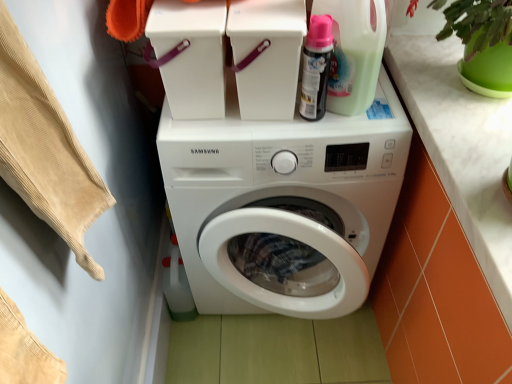
What do you see at coordinates (316, 67) in the screenshot? I see `matte black spray can at upper right, which is counted as the second cleaning product, starting from the right` at bounding box center [316, 67].

Describe the element at coordinates (284, 202) in the screenshot. I see `white glossy washing machine at center` at that location.

The height and width of the screenshot is (384, 512). What do you see at coordinates (461, 148) in the screenshot?
I see `white marble countertop at upper right` at bounding box center [461, 148].

The height and width of the screenshot is (384, 512). What are the coordinates of `matte black spray can at upper right, the first cleaning product viewed from the left` in the screenshot? It's located at (316, 67).

Is beige corduroy fabric at left oriented towards white glossy washing machine at center?

No, beige corduroy fabric at left is not oriented towards white glossy washing machine at center.

Considering the sizes of objects beige corduroy fabric at left and white glossy washing machine at center in the image provided, who is shorter, beige corduroy fabric at left or white glossy washing machine at center?

beige corduroy fabric at left is shorter.

In order to click on clothing in front of the white glossy washing machine at center in this screenshot , I will do `click(45, 149)`.

Does point (507, 126) appear closer or farther from the camera than point (79, 256)?

Point (507, 126).

What's the angular difference between white marble countertop at upper right and beige corduroy fabric at left's facing directions?

The facing directions of white marble countertop at upper right and beige corduroy fabric at left are 89.1 degrees apart.

Would you say beige corduroy fabric at left is part of white marble countertop at upper right's contents?

Definitely not — beige corduroy fabric at left is not inside white marble countertop at upper right.

From the image's perspective, which object appears higher, white plastic container at upper center or beige corduroy fabric at left?

From the image's view, white plastic container at upper center is above.

Is white plastic container at upper center inside or outside of beige corduroy fabric at left?

white plastic container at upper center is not inside beige corduroy fabric at left, it's outside.

Is white plastic container at upper center to the left or to the right of beige corduroy fabric at left in the image?

white plastic container at upper center is to the right of beige corduroy fabric at left.

Between white plastic container at upper center and beige corduroy fabric at left, which one is positioned in front?

Positioned in front is beige corduroy fabric at left.

Can you tell me how much white glossy washing machine at center and white marble countertop at upper right differ in facing direction?

They differ by 89.1 degrees in their facing directions.

Considering the positions of objects white glossy washing machine at center and white marble countertop at upper right in the image provided, who is more to the left, white glossy washing machine at center or white marble countertop at upper right?

white glossy washing machine at center is more to the left.

Is white glossy washing machine at center far away from white marble countertop at upper right?

No, white glossy washing machine at center is not far from white marble countertop at upper right.

Image resolution: width=512 pixels, height=384 pixels. In order to click on counter top located on the right of white glossy washing machine at center in this screenshot , I will do `click(461, 148)`.

In terms of size, does matte black spray can at upper right, the first cleaning product viewed from the left, appear bigger or smaller than white plastic container at upper center?

Considering their sizes, matte black spray can at upper right, the first cleaning product viewed from the left, takes up less space than white plastic container at upper center.

From the image's perspective, which is above, matte black spray can at upper right, the first cleaning product viewed from the left, or white plastic container at upper center?

white plastic container at upper center is shown above in the image.

From a real-world perspective, is white marble countertop at upper right positioned above or below white plastic container at upper center?

Clearly, from a real-world perspective, white marble countertop at upper right is below white plastic container at upper center.

Between white marble countertop at upper right and white plastic container at upper center, which one has more height?

white plastic container at upper center.

Which object is positioned more to the right, white marble countertop at upper right or white plastic container at upper center?

white marble countertop at upper right is more to the right.

From the image's perspective, who appears lower, white marble countertop at upper right or matte black spray can at upper right, which is counted as the second cleaning product, starting from the right?

white marble countertop at upper right is shown below in the image.

Who is taller, white marble countertop at upper right or matte black spray can at upper right, the first cleaning product viewed from the left?

With more height is matte black spray can at upper right, the first cleaning product viewed from the left.

Is white marble countertop at upper right looking in the opposite direction of matte black spray can at upper right, the first cleaning product viewed from the left?

No, white marble countertop at upper right is not facing away from matte black spray can at upper right, the first cleaning product viewed from the left.

Who is more distant, white marble countertop at upper right or matte black spray can at upper right, which is counted as the second cleaning product, starting from the right?

matte black spray can at upper right, which is counted as the second cleaning product, starting from the right.

The image size is (512, 384). I want to click on washing machine behind the beige corduroy fabric at left, so click(284, 202).

The width and height of the screenshot is (512, 384). I want to click on clothing that is in front of the white marble countertop at upper right, so click(45, 149).

Looking at the image, which one is located further to white marble countertop at upper right, translucent plastic detergent bottle at upper right, arranged as the 2th cleaning product when viewed from the left, or beige corduroy fabric at left?

Based on the image, beige corduroy fabric at left appears to be further to white marble countertop at upper right.

Which object lies nearer to the anchor point beige corduroy fabric at left, white plastic container at upper center or translucent plastic detergent bottle at upper right, arranged as the 2th cleaning product when viewed from the left?

white plastic container at upper center is positioned closer to the anchor beige corduroy fabric at left.

Estimate the real-world distances between objects in this image. Which object is further from white plastic container at upper center, matte black spray can at upper right, the first cleaning product viewed from the left, or white marble countertop at upper right?

white marble countertop at upper right is positioned further to the anchor white plastic container at upper center.

From the image, which object appears to be nearer to white glossy washing machine at center, matte black spray can at upper right, which is counted as the second cleaning product, starting from the right, or white plastic container at upper center?

Based on the image, white plastic container at upper center appears to be nearer to white glossy washing machine at center.

When comparing their distances from white plastic container at upper center, does translucent plastic detergent bottle at upper right, arranged as the 2th cleaning product when viewed from the left, or beige corduroy fabric at left seem further?

Based on the image, beige corduroy fabric at left appears to be further to white plastic container at upper center.

When comparing their distances from white marble countertop at upper right, does white glossy washing machine at center or matte black spray can at upper right, which is counted as the second cleaning product, starting from the right, seem further?

Based on the image, white glossy washing machine at center appears to be further to white marble countertop at upper right.

From the image, which object appears to be farther from beige corduroy fabric at left, translucent plastic detergent bottle at upper right, the 1th cleaning product in the right-to-left sequence, or white glossy washing machine at center?

translucent plastic detergent bottle at upper right, the 1th cleaning product in the right-to-left sequence, is further to beige corduroy fabric at left.

When comparing their distances from white plastic container at upper center, does white marble countertop at upper right or translucent plastic detergent bottle at upper right, arranged as the 2th cleaning product when viewed from the left, seem closer?

Among the two, translucent plastic detergent bottle at upper right, arranged as the 2th cleaning product when viewed from the left, is located nearer to white plastic container at upper center.

Locate an element on the screen. This screenshot has height=384, width=512. cleaning product between matte black spray can at upper right, the first cleaning product viewed from the left, and white marble countertop at upper right, in the horizontal direction is located at coordinates (354, 52).

Identify the location of appliance located between beige corduroy fabric at left and white marble countertop at upper right in the left-right direction. This screenshot has width=512, height=384. (267, 55).

This screenshot has width=512, height=384. Identify the location of cleaning product between white plastic container at upper center and white glossy washing machine at center vertically. (316, 67).

The image size is (512, 384). Find the location of `appliance located between beige corduroy fabric at left and white glossy washing machine at center in the depth direction`. appliance located between beige corduroy fabric at left and white glossy washing machine at center in the depth direction is located at coordinates (267, 55).